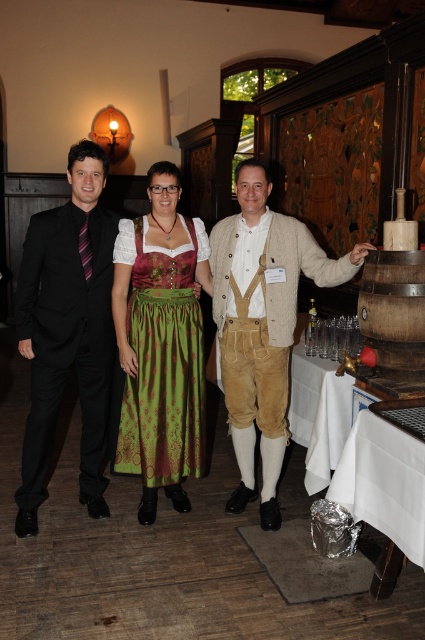
You are organizing a clothing display and have two items to place side by side. The black satin suit at left and the white cloth at right. Given their widths, which item should you place on the left side of the display to ensure they fit properly?

The black satin suit at left should be placed on the left side of the display since it is wider than the white cloth at right, ensuring proper fitting.